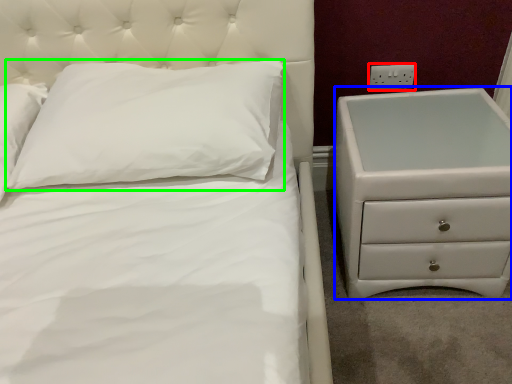
Question: Estimate the real-world distances between objects in this image. Which object is closer to electric outlet (highlighted by a red box), chest of drawers (highlighted by a blue box) or pillow (highlighted by a green box)?

Choices:
 (A) chest of drawers
 (B) pillow

Answer: (A)